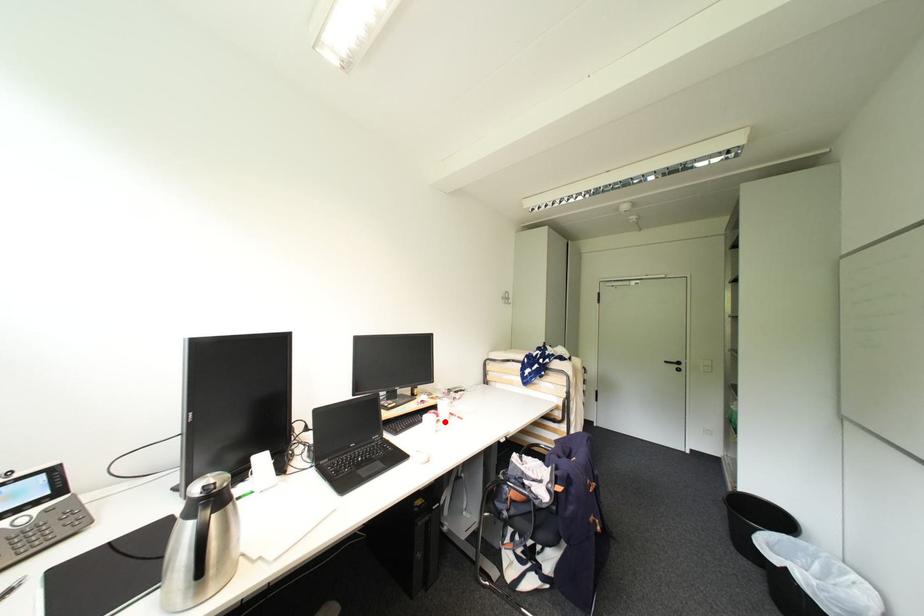
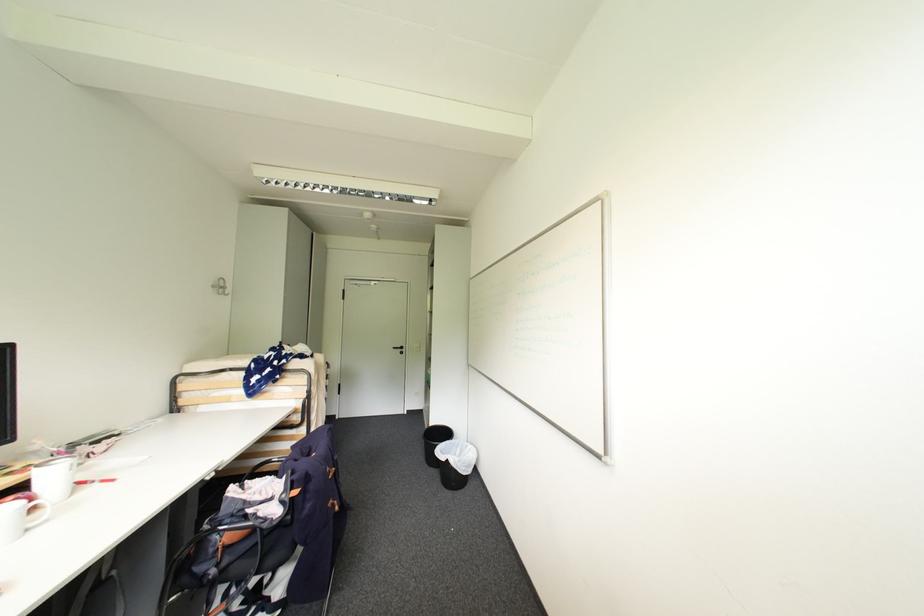
Question: I am providing you with two images of the same scene from different viewpoints. Image1 has a red point marked. In image2, the corresponding 3D location appears at what relative position? Reply with the corresponding letter.

Choices:
 (A) Closer
 (B) Farther

Answer: (A)